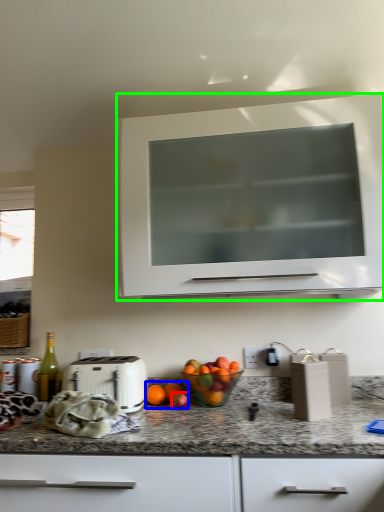
Question: Considering the real-world distances, which object is farthest from apple (highlighted by a red box)? citrus fruit (highlighted by a blue box) or cabinetry (highlighted by a green box)?

Choices:
 (A) citrus fruit
 (B) cabinetry

Answer: (B)